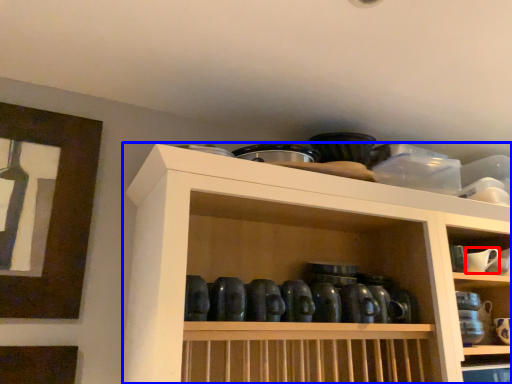
Question: Which of the following is the farthest to the observer, tableware (highlighted by a red box) or shelf (highlighted by a blue box)?

Choices:
 (A) tableware
 (B) shelf

Answer: (A)